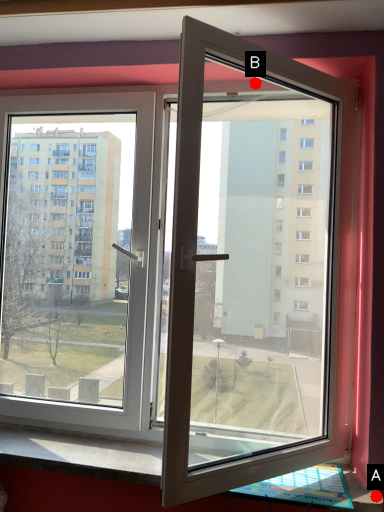
Question: Two points are circled on the image, labeled by A and B beside each circle. Among these points, which one is farthest from the camera?

Choices:
 (A) A is further
 (B) B is further

Answer: (B)